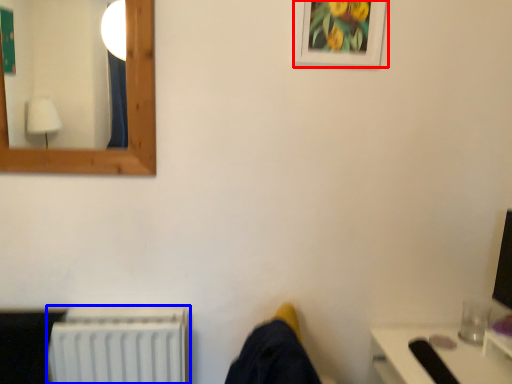
Question: Which point is closer to the camera, picture frame (highlighted by a red box) or radiator (highlighted by a blue box)?

Choices:
 (A) picture frame
 (B) radiator

Answer: (A)